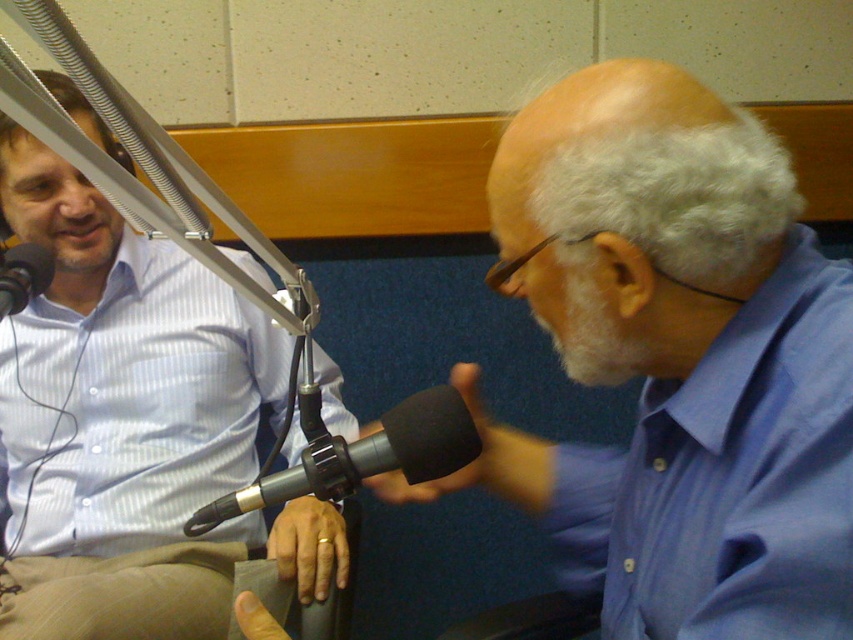
You are a sound engineer in a radio studio. You need to adjust the volume for the person wearing the blue glossy shirt at right and the black matte microphone at left. Which one is positioned further to the right side of the studio?

The blue glossy shirt at right is positioned to the right of the black matte microphone at left, so the blue glossy shirt at right is further to the right side of the studio.

You are a photographer setting up for a photo shoot in the studio. You need to place a light exactly halfway between the two points marked as point (595, 180) and point (22, 253). Will this light be closer to the camera or further away compared to the average distance of the two points?

The light placed halfway between the two points will be closer to the camera than the average distance of the two points because point (595, 180) is closer to the camera than point (22, 253). The midpoint will be closer to the nearer point, so it will be closer than the average distance.